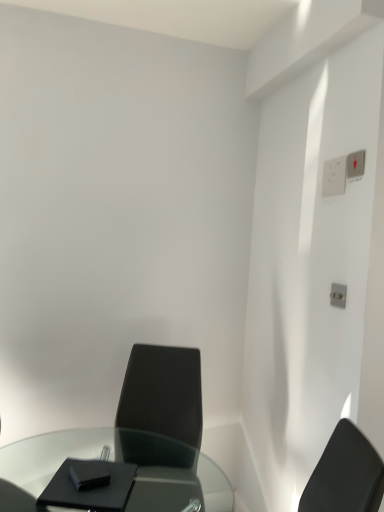
Question: Considering the relative sizes of white plastic switch at upper right, the 1th electric outlet positioned from the front, and transparent glass table at lower left in the image provided, is white plastic switch at upper right, the 1th electric outlet positioned from the front, bigger than transparent glass table at lower left?

Choices:
 (A) yes
 (B) no

Answer: (B)

Question: Is transparent glass table at lower left at the back of white plastic switch at upper right, the 1th electric outlet positioned from the front?

Choices:
 (A) no
 (B) yes

Answer: (A)

Question: Can you confirm if white plastic switch at upper right, the 1th electric outlet positioned from the front, is shorter than transparent glass table at lower left?

Choices:
 (A) no
 (B) yes

Answer: (B)

Question: Can you confirm if white plastic switch at upper right, the 1th electric outlet positioned from the front, is positioned to the left of transparent glass table at lower left?

Choices:
 (A) no
 (B) yes

Answer: (A)

Question: Can you confirm if white plastic switch at upper right, the 2th electric outlet positioned from the back, is thinner than transparent glass table at lower left?

Choices:
 (A) yes
 (B) no

Answer: (A)

Question: Considering the positions of matte black chair at center and white plastic switch at upper right, the 1th electric outlet positioned from the front, in the image, is matte black chair at center wider or thinner than white plastic switch at upper right, the 1th electric outlet positioned from the front,?

Choices:
 (A) thin
 (B) wide

Answer: (B)

Question: From the image's perspective, is matte black chair at center located above or below white plastic switch at upper right, the 1th electric outlet positioned from the front?

Choices:
 (A) below
 (B) above

Answer: (A)

Question: Considering the positions of point (168, 355) and point (362, 153), is point (168, 355) closer or farther from the camera than point (362, 153)?

Choices:
 (A) farther
 (B) closer

Answer: (A)

Question: Is matte black chair at center taller or shorter than white plastic switch at upper right, the 1th electric outlet positioned from the front?

Choices:
 (A) short
 (B) tall

Answer: (B)

Question: Looking at their shapes, would you say white plastic switch at upper right, the 1th electric outlet positioned from the front, is wider or thinner than matte black chair at center?

Choices:
 (A) wide
 (B) thin

Answer: (B)

Question: In terms of size, does white plastic switch at upper right, the 2th electric outlet positioned from the back, appear bigger or smaller than matte black chair at center?

Choices:
 (A) small
 (B) big

Answer: (A)

Question: Would you say white plastic switch at upper right, the 1th electric outlet positioned from the front, is to the left or to the right of matte black chair at center in the picture?

Choices:
 (A) right
 (B) left

Answer: (A)

Question: Is white plastic switch at upper right, the 1th electric outlet positioned from the front, inside the boundaries of matte black chair at center, or outside?

Choices:
 (A) inside
 (B) outside

Answer: (B)

Question: Is white plastic electric outlet at upper right, the 2th electric outlet in the front-to-back sequence, wider or thinner than matte black chair at center?

Choices:
 (A) wide
 (B) thin

Answer: (B)

Question: Considering their positions, is white plastic electric outlet at upper right, the 2th electric outlet in the front-to-back sequence, located in front of or behind matte black chair at center?

Choices:
 (A) behind
 (B) front

Answer: (A)